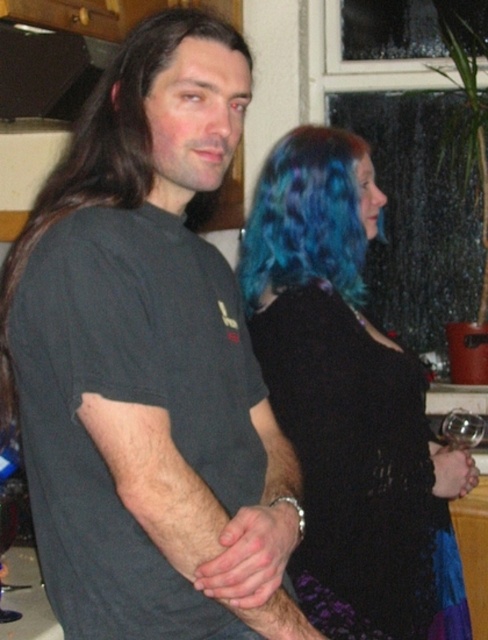
Who is positioned more to the right, black lace dress at center or clear glass wine glass at lower left?

black lace dress at center is more to the right.

From the picture: Can you confirm if black lace dress at center is taller than clear glass wine glass at lower left?

Correct, black lace dress at center is much taller as clear glass wine glass at lower left.

Is point (354, 528) positioned before point (0, 593)?

No, it is not.

Where is `black lace dress at center`? This screenshot has height=640, width=488. black lace dress at center is located at coordinates (348, 403).

Which of these two, black matte hair at left or clear glass wine glass at lower left, stands shorter?

clear glass wine glass at lower left is shorter.

Who is more forward, [101,179] or [7,493]?

Positioned in front is point [101,179].

Identify the location of black matte hair at left. (104, 150).

Is point (333, 284) positioned behind point (15, 532)?

Yes, it is behind point (15, 532).

Identify the location of blue dyed hair at upper right. The height and width of the screenshot is (640, 488). (305, 218).

Which is in front, point (343, 209) or point (5, 493)?

Point (5, 493)

This screenshot has height=640, width=488. I want to click on blue dyed hair at upper right, so click(x=305, y=218).